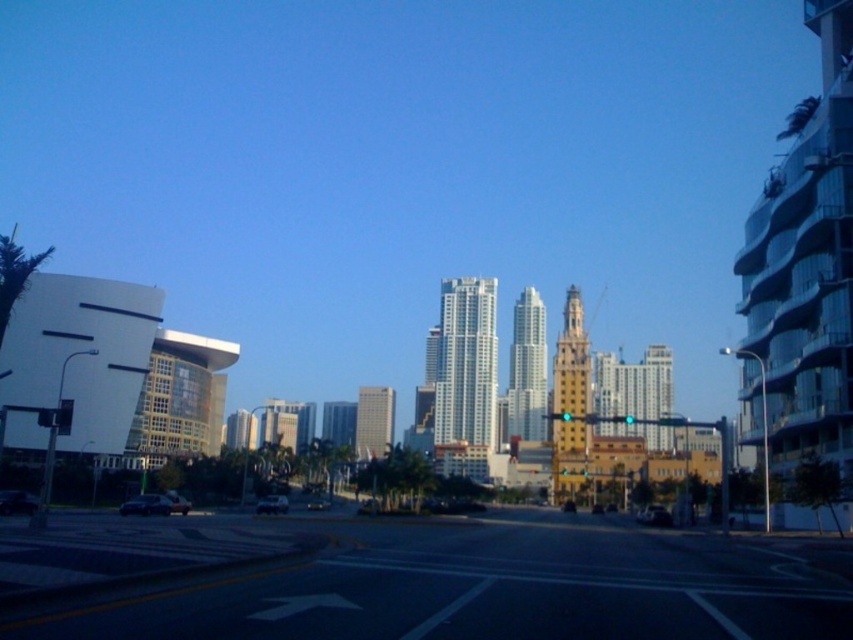
Locate an element on the screen. glassy white building at right is located at coordinates (804, 275).

Based on the photo, is glassy white building at right wider than yellow brick tower at center?

Yes, glassy white building at right is wider than yellow brick tower at center.

Is point (746, 356) closer to camera compared to point (585, 365)?

Yes, point (746, 356) is closer to viewer.

Locate an element on the screen. The image size is (853, 640). glassy white building at right is located at coordinates (804, 275).

What do you see at coordinates (804, 275) in the screenshot? This screenshot has height=640, width=853. I see `glassy white building at right` at bounding box center [804, 275].

Does glassy white building at right have a lesser height compared to silver glass skyscraper at center?

No.

The image size is (853, 640). What do you see at coordinates (804, 275) in the screenshot? I see `glassy white building at right` at bounding box center [804, 275].

The image size is (853, 640). In order to click on glassy white building at right in this screenshot , I will do click(804, 275).

Who is more distant from viewer, [463,380] or [569,404]?

The point [463,380] is behind.

Does white glass building at center have a lesser height compared to yellow brick tower at center?

No, white glass building at center is not shorter than yellow brick tower at center.

Is point (480, 433) closer to camera compared to point (573, 368)?

No, it is not.

Find the location of a particular element. The image size is (853, 640). white glass building at center is located at coordinates (465, 378).